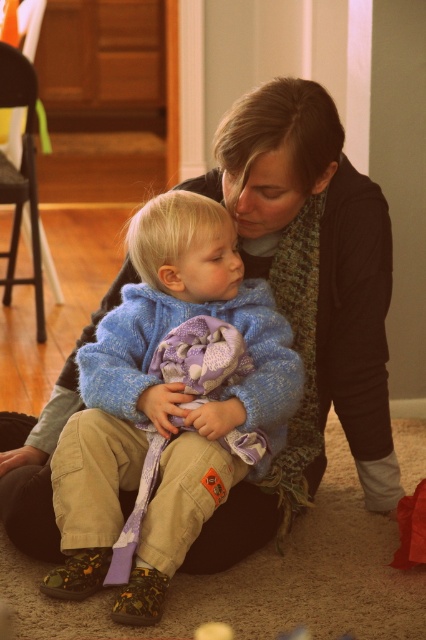
Question: Which object appears closest to the camera in this image?

Choices:
 (A) blue knitted sweater at center
 (B) knitted scarf at center

Answer: (A)

Question: Does knitted scarf at center have a larger size compared to blue knitted sweater at center?

Choices:
 (A) no
 (B) yes

Answer: (B)

Question: Among these points, which one is farthest from the camera?

Choices:
 (A) (0, 474)
 (B) (55, 477)

Answer: (A)

Question: Which point is farther to the camera?

Choices:
 (A) (166, 529)
 (B) (267, 538)

Answer: (B)

Question: Can you confirm if knitted scarf at center is bigger than blue knitted sweater at center?

Choices:
 (A) no
 (B) yes

Answer: (B)

Question: Is knitted scarf at center thinner than blue knitted sweater at center?

Choices:
 (A) no
 (B) yes

Answer: (B)